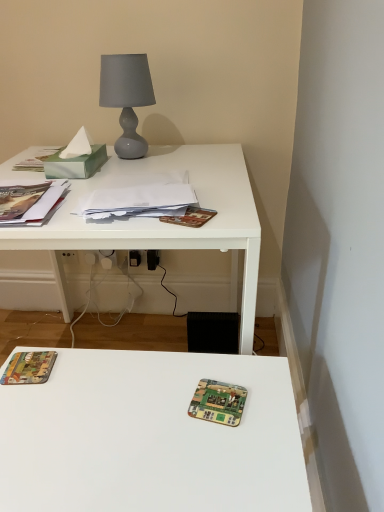
The image size is (384, 512). Identify the location of vacant point to the right of brown textured paper at center, arranged as the second paperback book when viewed from the left. (236, 213).